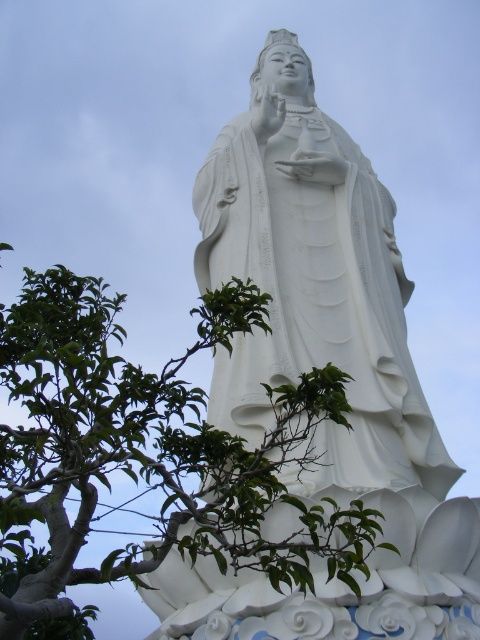
Question: Which point is farther from the camera taking this photo?

Choices:
 (A) (352, 166)
 (B) (232, 566)

Answer: (A)

Question: Observing the image, what is the correct spatial positioning of green leafy tree at center in reference to white marble statue at center?

Choices:
 (A) right
 (B) left

Answer: (B)

Question: Is green leafy tree at center bigger than white marble statue at center?

Choices:
 (A) no
 (B) yes

Answer: (B)

Question: Which point is closer to the camera?

Choices:
 (A) pos(326,241)
 (B) pos(38,618)

Answer: (B)

Question: Is green leafy tree at center thinner than white marble statue at center?

Choices:
 (A) no
 (B) yes

Answer: (A)